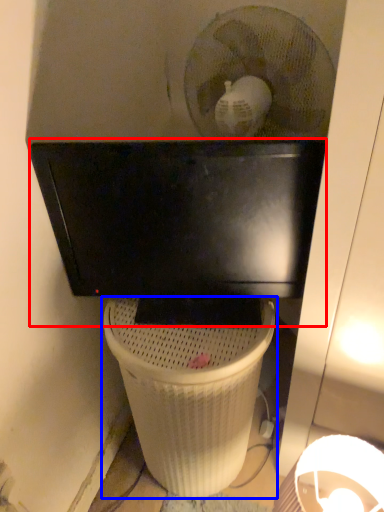
Question: Among these objects, which one is nearest to the camera, computer monitor (highlighted by a red box) or waste container (highlighted by a blue box)?

Choices:
 (A) computer monitor
 (B) waste container

Answer: (A)